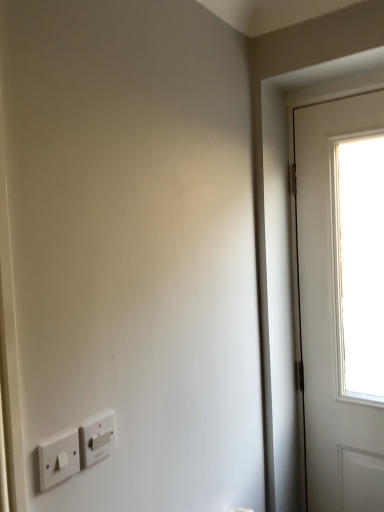
Question: Is white plastic light switch at lower left, the second light switch viewed from the back, at the back of white plastic light switch at lower left, the second light switch when ordered from front to back?

Choices:
 (A) yes
 (B) no

Answer: (B)

Question: Is white plastic light switch at lower left, which ranks as the first light switch in back-to-front order, positioned before white plastic light switch at lower left, which appears as the 2th light switch when viewed from the right?

Choices:
 (A) no
 (B) yes

Answer: (A)

Question: Does white plastic light switch at lower left, the second light switch when ordered from front to back, have a greater width compared to white plastic light switch at lower left, the second light switch viewed from the back?

Choices:
 (A) yes
 (B) no

Answer: (A)

Question: From a real-world perspective, does white plastic light switch at lower left, which ranks as the 2th light switch in left-to-right order, sit lower than white plastic light switch at lower left, which ranks as the 1th light switch in left-to-right order?

Choices:
 (A) no
 (B) yes

Answer: (B)

Question: Can you confirm if white plastic light switch at lower left, which ranks as the first light switch in back-to-front order, is smaller than white plastic light switch at lower left, which appears as the 2th light switch when viewed from the right?

Choices:
 (A) yes
 (B) no

Answer: (A)

Question: Are white plastic light switch at lower left, the second light switch when ordered from front to back, and white plastic light switch at lower left, which appears as the 2th light switch when viewed from the right, beside each other?

Choices:
 (A) yes
 (B) no

Answer: (A)

Question: Is white plastic light switch at lower left, which ranks as the 1th light switch in left-to-right order, at the left side of white plastic light switch at lower left, which ranks as the first light switch in back-to-front order?

Choices:
 (A) no
 (B) yes

Answer: (B)

Question: From a real-world perspective, is white plastic light switch at lower left, which ranks as the 1th light switch in left-to-right order, on top of white plastic light switch at lower left, the second light switch when ordered from front to back?

Choices:
 (A) yes
 (B) no

Answer: (A)

Question: From the image's perspective, is white plastic light switch at lower left, which ranks as the 1th light switch in left-to-right order, over white plastic light switch at lower left, which ranks as the first light switch in back-to-front order?

Choices:
 (A) yes
 (B) no

Answer: (B)

Question: Is white plastic light switch at lower left, which appears as the 2th light switch when viewed from the right, next to white plastic light switch at lower left, which is counted as the first light switch, starting from the right?

Choices:
 (A) no
 (B) yes

Answer: (B)

Question: Does white plastic light switch at lower left, the second light switch viewed from the back, have a larger size compared to white plastic light switch at lower left, the second light switch when ordered from front to back?

Choices:
 (A) no
 (B) yes

Answer: (B)

Question: Is white plastic light switch at lower left, which is the 1th light switch in front-to-back order, positioned in front of white plastic light switch at lower left, which ranks as the 2th light switch in left-to-right order?

Choices:
 (A) yes
 (B) no

Answer: (A)

Question: Considering the relative positions of white plastic light switch at lower left, which appears as the 2th light switch when viewed from the right, and white plastic light switch at lower left, which is counted as the first light switch, starting from the right, in the image provided, is white plastic light switch at lower left, which appears as the 2th light switch when viewed from the right, to the left or to the right of white plastic light switch at lower left, which is counted as the first light switch, starting from the right,?

Choices:
 (A) right
 (B) left

Answer: (B)